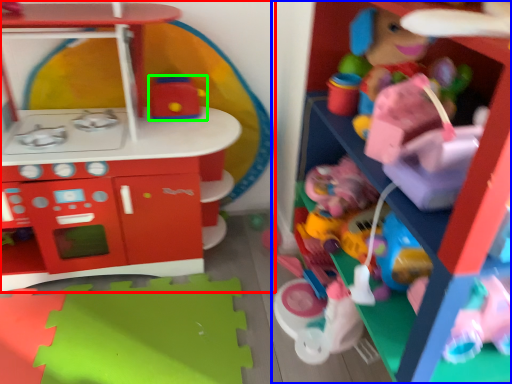
Question: Estimate the real-world distances between objects in this image. Which object is closer to toy (highlighted by a red box), toy (highlighted by a blue box) or toy (highlighted by a green box)?

Choices:
 (A) toy
 (B) toy

Answer: (B)